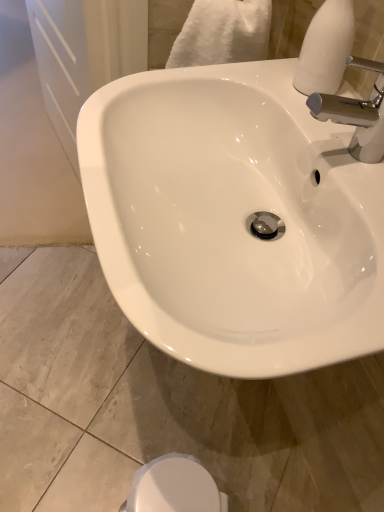
Locate an element on the screen. The image size is (384, 512). free space behind chrome metallic faucet at upper right is located at coordinates (314, 105).